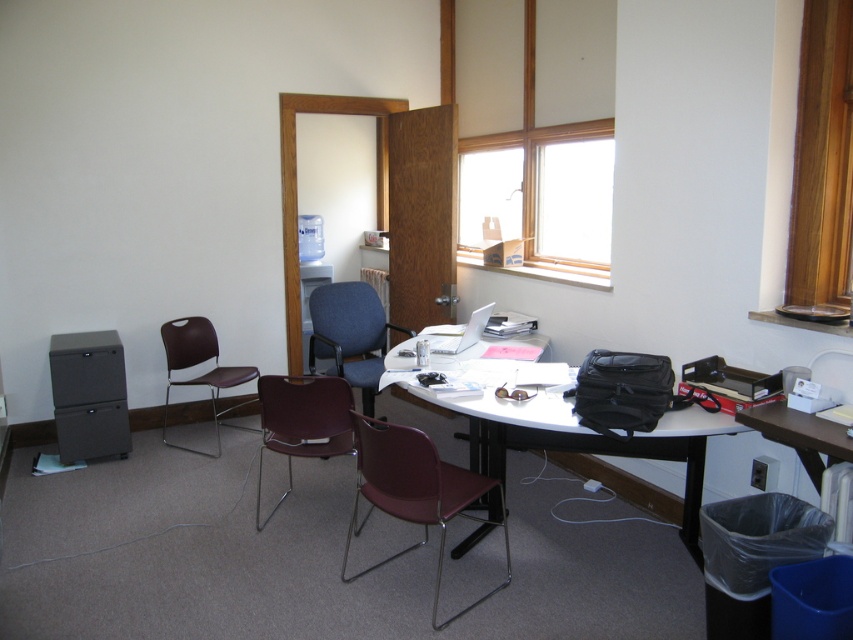
Question: Which point is closer to the camera?

Choices:
 (A) blue fabric chair at center
 (B) matte black table at center

Answer: (B)

Question: Is matte black table at center wider than matte plastic chair at center?

Choices:
 (A) no
 (B) yes

Answer: (B)

Question: From the image, what is the correct spatial relationship of maroon plastic chair at center in relation to matte plastic chair at center?

Choices:
 (A) above
 (B) below

Answer: (B)

Question: Which object is closer to the camera taking this photo?

Choices:
 (A) matte black table at center
 (B) maroon plastic chair at center

Answer: (B)

Question: Is matte black table at center below blue fabric chair at center?

Choices:
 (A) yes
 (B) no

Answer: (A)

Question: Which of these objects is positioned closest to the maroon plastic chair at center?

Choices:
 (A) blue fabric chair at center
 (B) matte black table at center

Answer: (B)